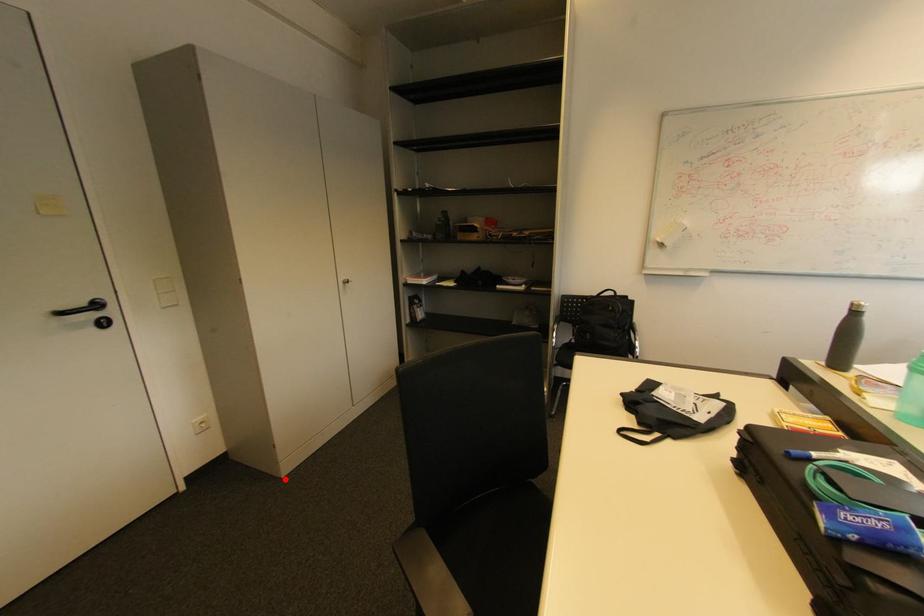
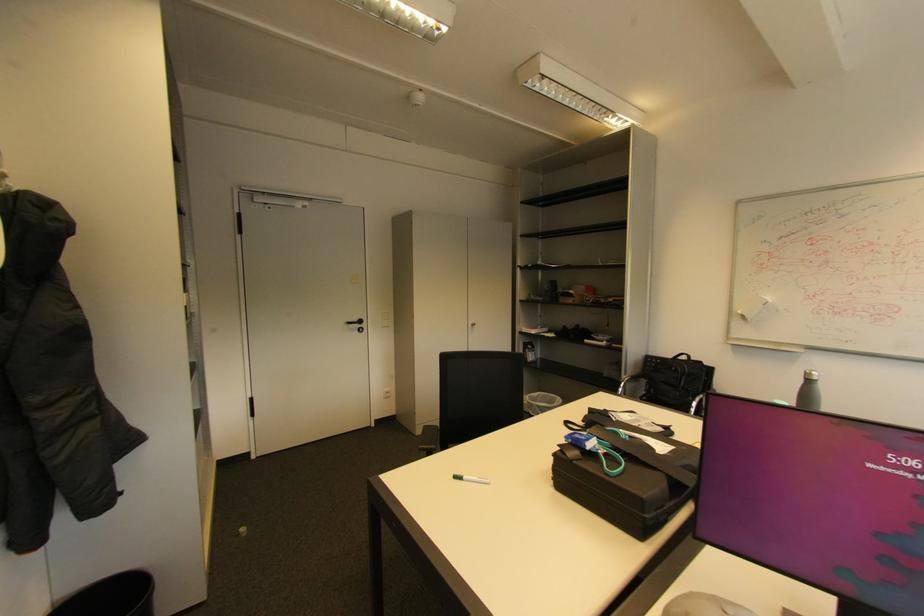
Question: I am providing you with two images of the same scene from different viewpoints. Image1 has a red point marked. In image2, the corresponding 3D location appears at what relative position? Reply with the corresponding letter.

Choices:
 (A) Closer
 (B) Farther

Answer: (B)